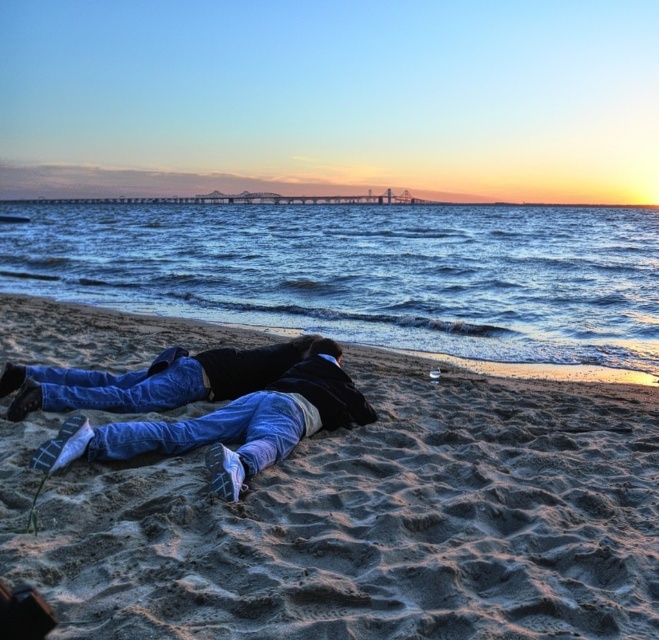
Locate an element on the screen. The image size is (659, 640). denim jeans at center is located at coordinates (229, 424).

Does point (59, 451) come closer to viewer compared to point (115, 408)?

Yes, it is.

Identify the location of denim jeans at center. (x=229, y=424).

Is point (556, 529) closer to camera compared to point (583, 292)?

Yes, it is.

Is sandy beach at lower center smaller than blue water at center?

Indeed, sandy beach at lower center has a smaller size compared to blue water at center.

You are a GUI agent. You are given a task and a screenshot of the screen. Output one action in this format:
    pyautogui.click(x=<x>, y=<y>)
    Task: Click on the sandy beach at lower center
    This screenshot has height=640, width=659.
    Given the screenshot: What is the action you would take?
    pyautogui.click(x=364, y=522)

This screenshot has width=659, height=640. I want to click on sandy beach at lower center, so click(364, 522).

Is point (587, 348) positioned after point (61, 369)?

That is True.

Consider the image. Who is positioned more to the right, blue water at center or blue jeans at lower center?

blue water at center is more to the right.

Locate an element on the screen. This screenshot has width=659, height=640. blue water at center is located at coordinates (364, 273).